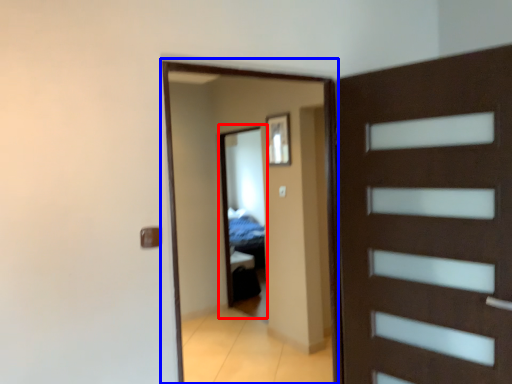
Question: Among these objects, which one is nearest to the camera, mirror (highlighted by a red box) or screen door (highlighted by a blue box)?

Choices:
 (A) mirror
 (B) screen door

Answer: (B)